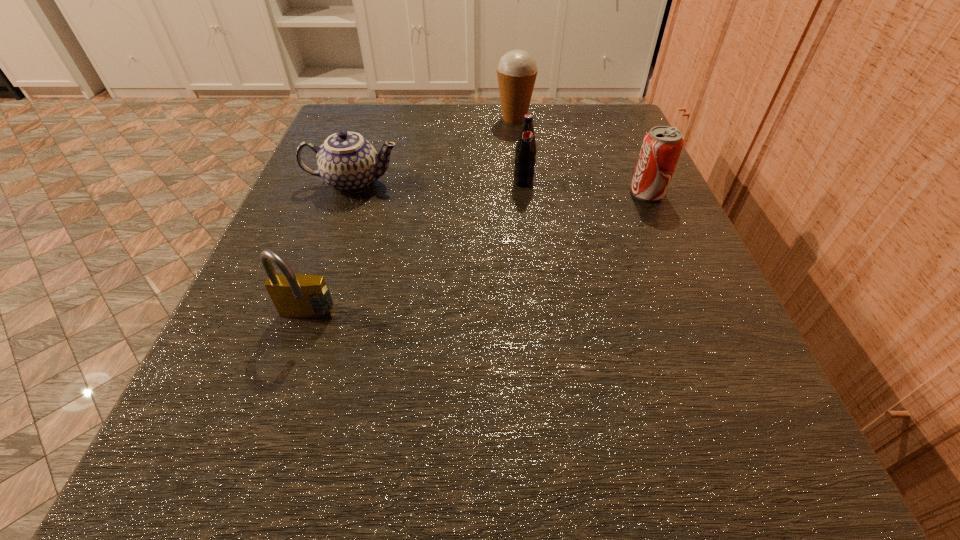
Identify the location of icecream. This screenshot has width=960, height=540. (517, 70).

Find the location of `the left soda can`. the left soda can is located at coordinates (525, 152).

I want to click on the right soda can, so click(x=661, y=148).

Image resolution: width=960 pixels, height=540 pixels. I want to click on the nearest object, so click(x=302, y=296).

Find the location of `chinaware`. chinaware is located at coordinates (347, 162).

This screenshot has width=960, height=540. What are the coordinates of `blank area located on the left of the icecream` in the screenshot? It's located at (427, 118).

I want to click on free location located on the front label of the left soda can, so click(x=539, y=308).

This screenshot has width=960, height=540. I want to click on vacant space situated 0.280m on the front of the right soda can, so click(717, 349).

What are the coordinates of `free location located on the side with the combination dials of the padlock` in the screenshot? It's located at (284, 384).

Where is `vacant space located from the spout of the chinaware`? This screenshot has width=960, height=540. vacant space located from the spout of the chinaware is located at coordinates click(x=638, y=183).